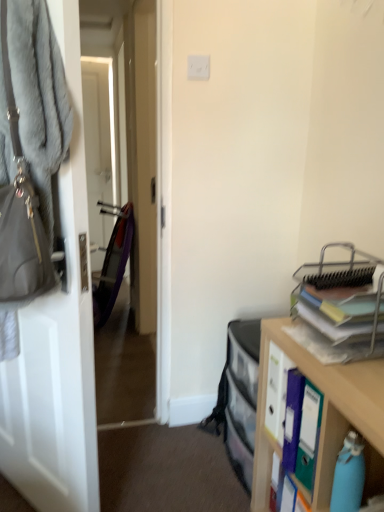
Question: Should I look upward or downward to see white matte door at left?

Choices:
 (A) down
 (B) up

Answer: (A)

Question: From the image's perspective, does metallic silver organizer at right appear lower than gray fuzzy coat at left?

Choices:
 (A) yes
 (B) no

Answer: (A)

Question: Does metallic silver organizer at right have a lesser width compared to gray fuzzy coat at left?

Choices:
 (A) yes
 (B) no

Answer: (B)

Question: Is metallic silver organizer at right oriented towards gray fuzzy coat at left?

Choices:
 (A) yes
 (B) no

Answer: (B)

Question: Is metallic silver organizer at right far away from gray fuzzy coat at left?

Choices:
 (A) yes
 (B) no

Answer: (A)

Question: Does metallic silver organizer at right come in front of gray fuzzy coat at left?

Choices:
 (A) no
 (B) yes

Answer: (B)

Question: Is metallic silver organizer at right behind gray fuzzy coat at left?

Choices:
 (A) yes
 (B) no

Answer: (B)

Question: Is wooden cabinet at right positioned behind gray fuzzy coat at left?

Choices:
 (A) yes
 (B) no

Answer: (B)

Question: Is the surface of wooden cabinet at right in direct contact with gray fuzzy coat at left?

Choices:
 (A) yes
 (B) no

Answer: (B)

Question: Is wooden cabinet at right looking in the opposite direction of gray fuzzy coat at left?

Choices:
 (A) no
 (B) yes

Answer: (A)

Question: Can you confirm if wooden cabinet at right is wider than gray fuzzy coat at left?

Choices:
 (A) no
 (B) yes

Answer: (B)

Question: Can you confirm if wooden cabinet at right is shorter than gray fuzzy coat at left?

Choices:
 (A) no
 (B) yes

Answer: (B)

Question: Does wooden cabinet at right have a larger size compared to gray fuzzy coat at left?

Choices:
 (A) no
 (B) yes

Answer: (B)

Question: Is gray furry handbag at left facing towards wooden cabinet at right?

Choices:
 (A) yes
 (B) no

Answer: (B)